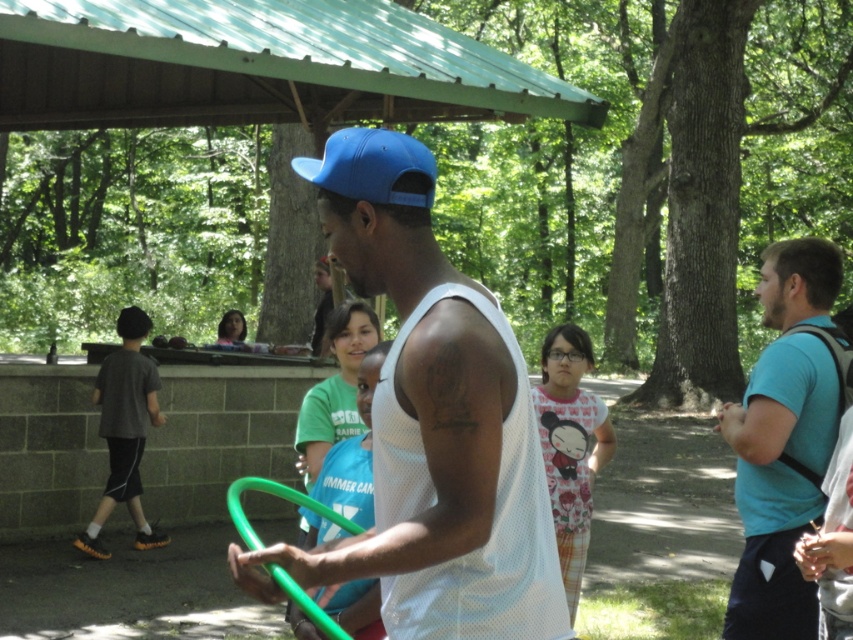
Question: Which object appears closest to the camera in this image?

Choices:
 (A) blue mesh shirt at right
 (B) white mesh tank top at center

Answer: (B)

Question: Is the position of white mesh tank top at center less distant than that of blue mesh shirt at right?

Choices:
 (A) yes
 (B) no

Answer: (A)

Question: Does white mesh tank top at center come behind blue mesh shirt at right?

Choices:
 (A) no
 (B) yes

Answer: (A)

Question: Does white mesh tank top at center have a greater width compared to blue mesh shirt at right?

Choices:
 (A) yes
 (B) no

Answer: (A)

Question: Which point is closer to the camera?

Choices:
 (A) (796, 605)
 (B) (465, 374)

Answer: (B)